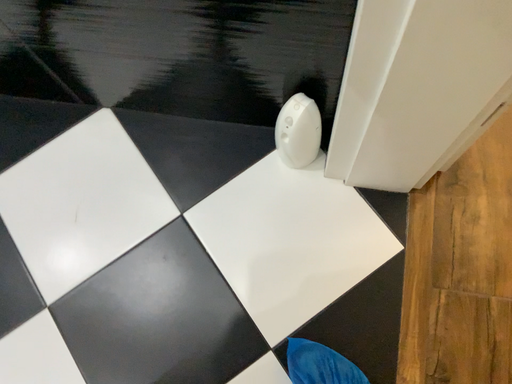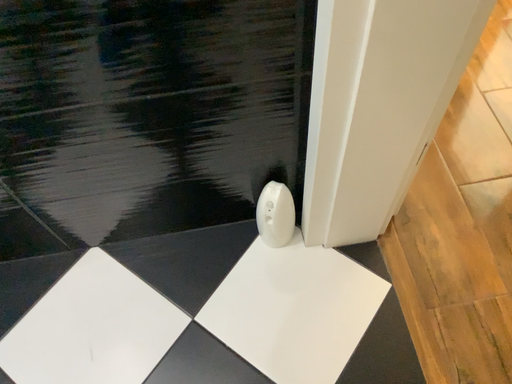
Question: How did the camera likely rotate when shooting the video?

Choices:
 (A) rotated downward
 (B) rotated upward

Answer: (B)